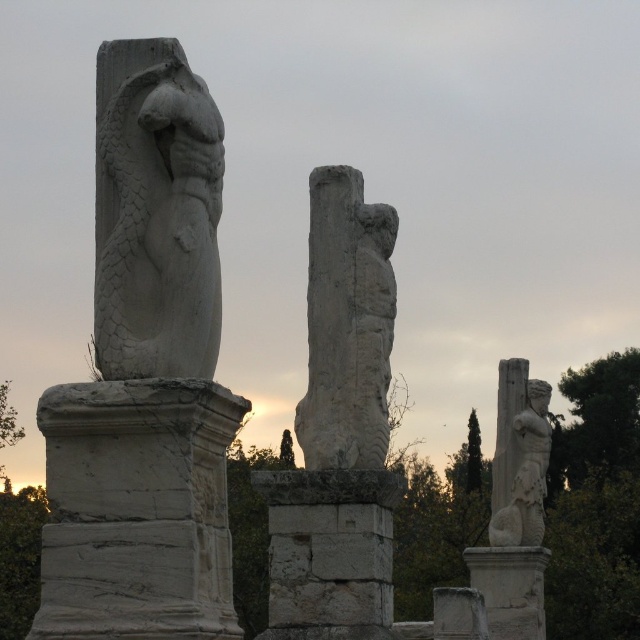
Question: Does white stone dragon at center appear on the right side of white stone pillar at lower right?

Choices:
 (A) yes
 (B) no

Answer: (B)

Question: Which object is positioned farthest from the white stone dragon at center?

Choices:
 (A) white stone pillar at lower right
 (B) white marble statue at right
 (C) white stone pillar at center

Answer: (B)

Question: Does white stone pillar at lower right appear under white stone statue at right?

Choices:
 (A) yes
 (B) no

Answer: (A)

Question: Can you confirm if white stone dragon at center is bigger than white stone statue at right?

Choices:
 (A) yes
 (B) no

Answer: (B)

Question: Based on their relative distances, which object is nearer to the white marble statue at right?

Choices:
 (A) white stone figure at center
 (B) white stone statue at right

Answer: (B)

Question: Which of the following is the closest to the observer?

Choices:
 (A) white stone figure at center
 (B) white stone pillar at left
 (C) white stone statue at right

Answer: (B)